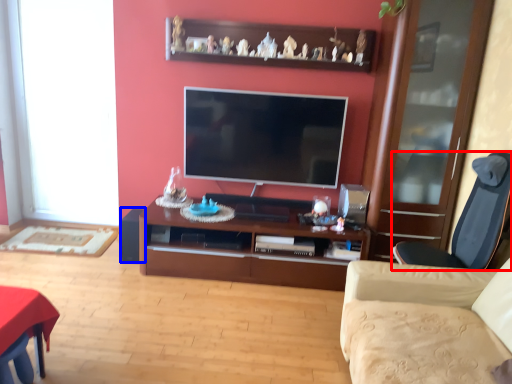
Question: Among these objects, which one is farthest to the camera, chair (highlighted by a red box) or speaker (highlighted by a blue box)?

Choices:
 (A) chair
 (B) speaker

Answer: (B)